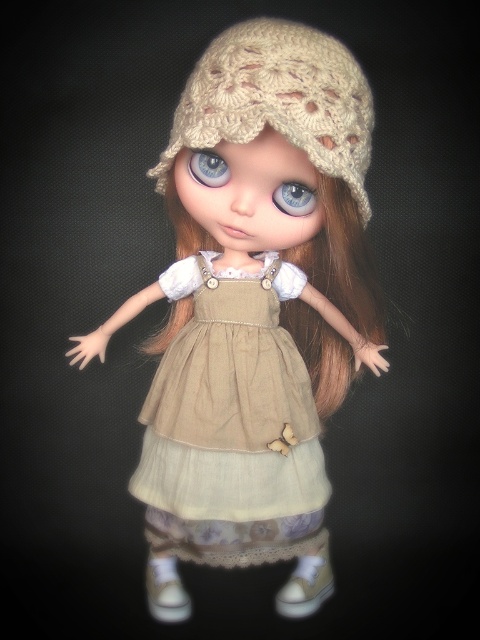
Question: Which point is closer to the camera?

Choices:
 (A) (298, 195)
 (B) (196, 161)
 (C) (159, 397)
 (D) (177, 148)

Answer: (D)

Question: Which object is closer to the camera taking this photo?

Choices:
 (A) beige knitted hat at upper center
 (B) blue matte eye at center
 (C) beige cotton dress at center
 (D) blue glass eye at center

Answer: (A)

Question: Which of the following is the closest to the observer?

Choices:
 (A) (262, 100)
 (B) (276, 474)

Answer: (A)

Question: In this image, where is beige knitted hat at center located relative to blue matte eye at center?

Choices:
 (A) above
 (B) below

Answer: (A)

Question: Is beige knitted hat at upper center wider than beige knitted hat at center?

Choices:
 (A) yes
 (B) no

Answer: (A)

Question: Can you confirm if beige knitted hat at upper center is positioned to the left of beige knitted hat at center?

Choices:
 (A) yes
 (B) no

Answer: (A)